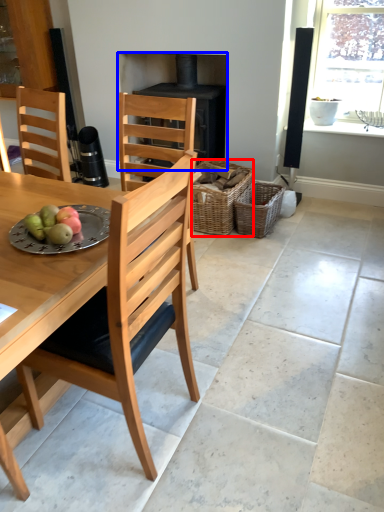
Question: Which point is further to the camera, basket (highlighted by a red box) or fireplace (highlighted by a blue box)?

Choices:
 (A) basket
 (B) fireplace

Answer: (B)